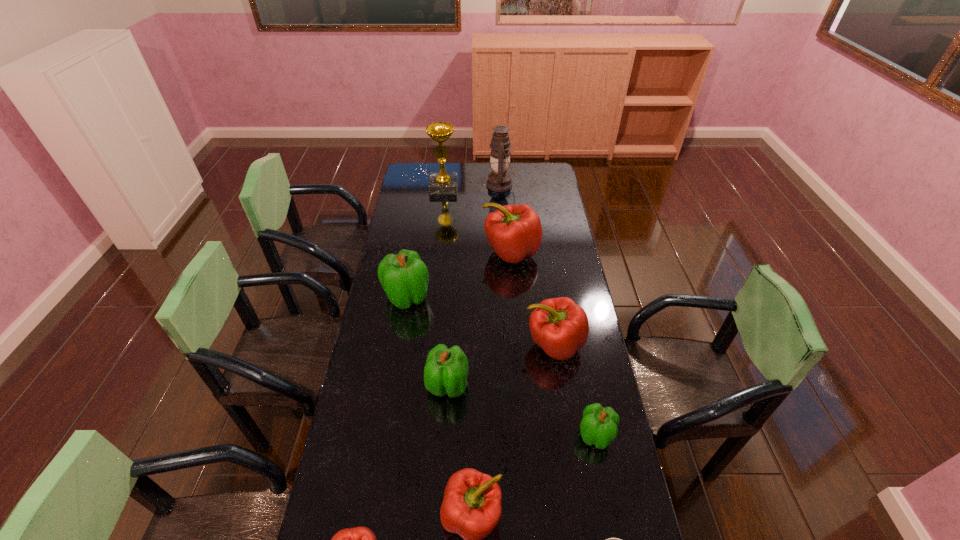
Find the location of a particular element. The width and height of the screenshot is (960, 540). blue oil lamp is located at coordinates (499, 180).

Identify the location of award. The width and height of the screenshot is (960, 540). tap(442, 182).

The width and height of the screenshot is (960, 540). In order to click on the third farthest object in this screenshot , I will do `click(514, 232)`.

I want to click on the farthest bell pepper, so click(x=514, y=232).

Identify the location of the biggest green bell pepper. [404, 277].

Image resolution: width=960 pixels, height=540 pixels. In order to click on the sixth nearest bell pepper in this screenshot , I will do `click(404, 277)`.

Where is `the second farthest pink bell pepper`? the second farthest pink bell pepper is located at coordinates (559, 326).

In order to click on the second nearest green bell pepper in this screenshot , I will do `click(446, 370)`.

Find the location of a particular element. the second green bell pepper from left to right is located at coordinates (446, 370).

Locate an element on the screen. the nearest green bell pepper is located at coordinates 598,426.